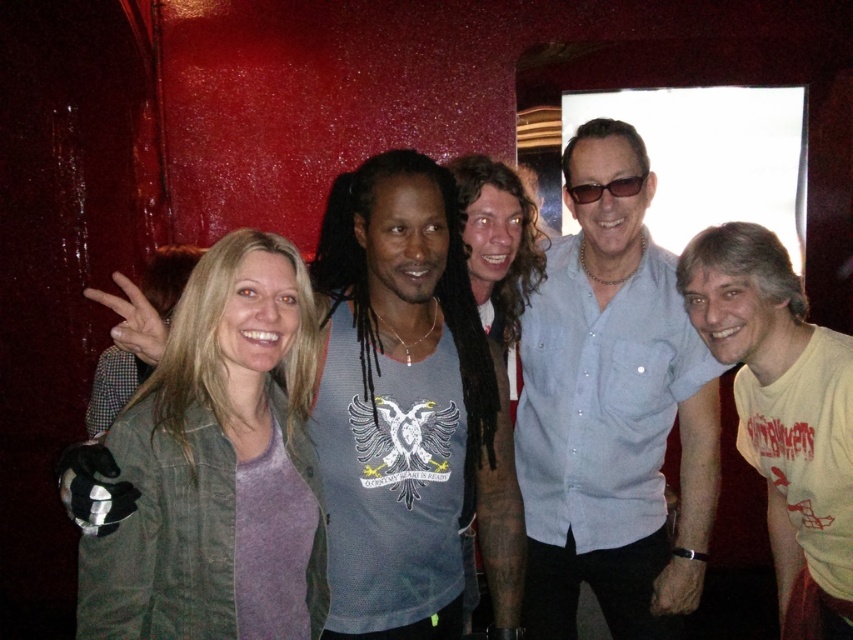
Who is more forward, (463, 556) or (589, 200)?

Point (589, 200)

Does matte purple shirt at center appear over black plastic sunglasses at center?

Incorrect, matte purple shirt at center is not positioned above black plastic sunglasses at center.

Who is more distant from viewer, (531, 241) or (637, 182)?

Point (531, 241)

Where is `matte purple shirt at center`? The height and width of the screenshot is (640, 853). matte purple shirt at center is located at coordinates (498, 250).

Is light blue button-up shirt at center positioned behind matte purple shirt at center?

No, light blue button-up shirt at center is in front of matte purple shirt at center.

Based on the photo, can you confirm if light blue button-up shirt at center is positioned to the left of matte purple shirt at center?

No, light blue button-up shirt at center is not to the left of matte purple shirt at center.

Is point (585, 266) positioned in front of point (532, 275)?

Yes, point (585, 266) is in front of point (532, 275).

The image size is (853, 640). What are the coordinates of `light blue button-up shirt at center` in the screenshot? It's located at (612, 413).

Can you confirm if light blue button-up shirt at center is bigger than green denim jacket at center?

Indeed, light blue button-up shirt at center has a larger size compared to green denim jacket at center.

This screenshot has height=640, width=853. I want to click on light blue button-up shirt at center, so click(x=612, y=413).

Is point (575, 589) in front of point (270, 406)?

That is False.

Where is `light blue button-up shirt at center`? light blue button-up shirt at center is located at coordinates (612, 413).